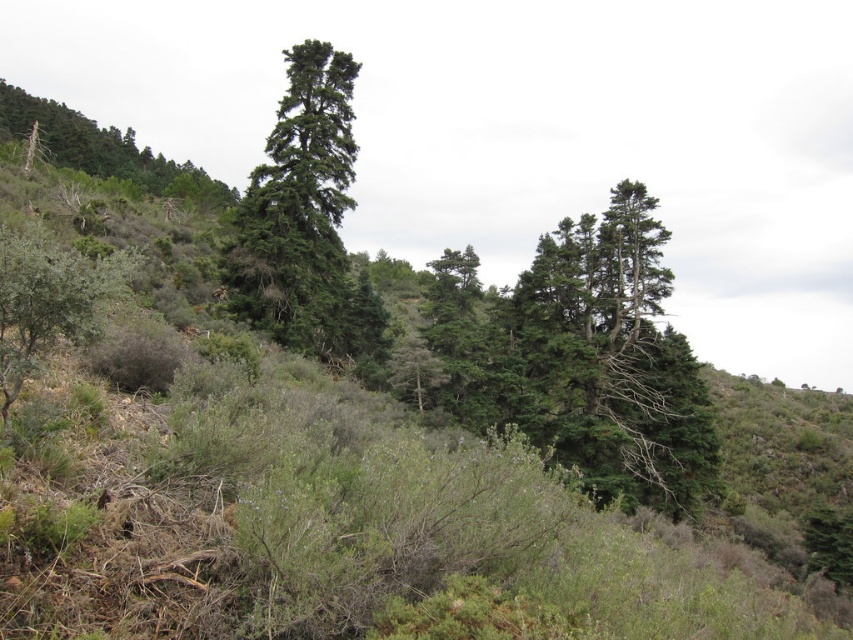
You are standing at the center of the image and want to locate the green leafy bush at lower left. Based on the coordinates provided, in which direction should you look to find it?

The green leafy bush at lower left is located at coordinates point [49,300], which means you should look to the lower left direction to find it.